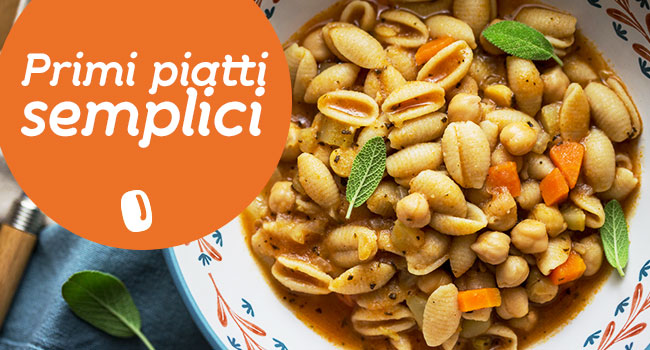
Image resolution: width=650 pixels, height=350 pixels. Find the location of `tablecloth`. tablecloth is located at coordinates (47, 317), (143, 282), (78, 248).